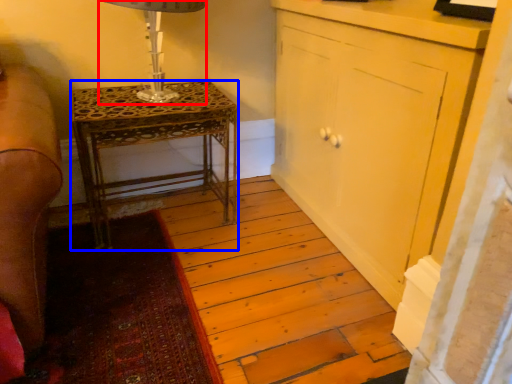
Question: Which point is further to the camera, table lamp (highlighted by a red box) or nightstand (highlighted by a blue box)?

Choices:
 (A) table lamp
 (B) nightstand

Answer: (B)